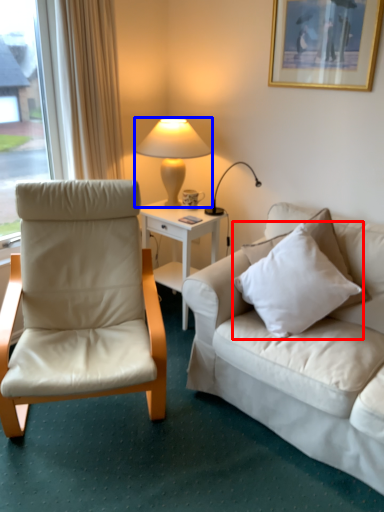
Question: Which object appears closest to the camera in this image, pillow (highlighted by a red box) or lamp (highlighted by a blue box)?

Choices:
 (A) pillow
 (B) lamp

Answer: (A)